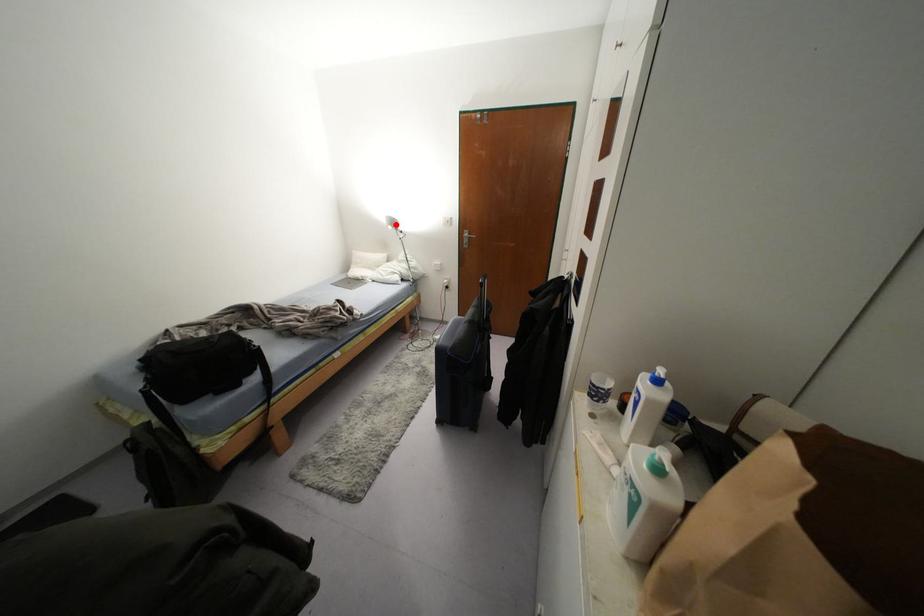
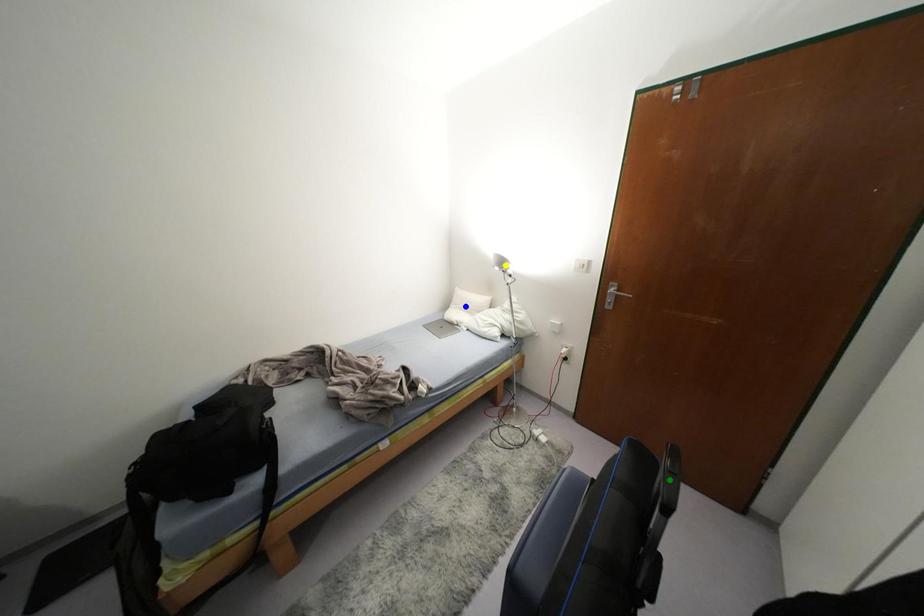
Question: I am providing you with two images of the same scene from different viewpoints. A red point is marked on the first image. You are given multiple points on the second image. Which point in image 2 represents the same 3d spot as the red point in image 1?

Choices:
 (A) green point
 (B) blue point
 (C) yellow point

Answer: (C)